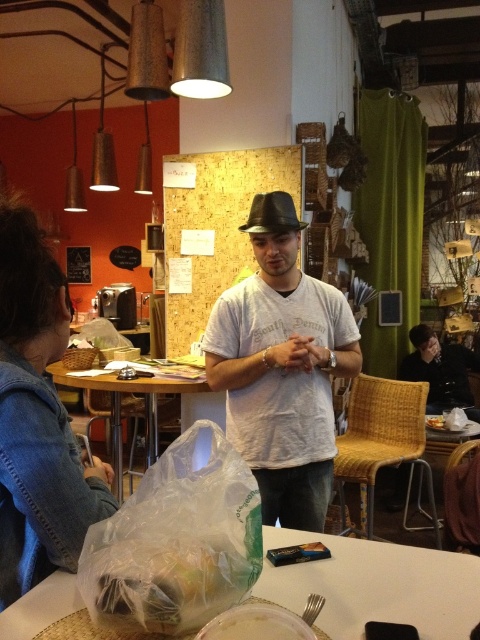
Question: Which point is farther to the camera?

Choices:
 (A) (16, 620)
 (B) (290, 422)
 (C) (256, 180)
 (D) (292, 632)

Answer: (C)

Question: Does corkboard at center have a larger size compared to white plastic container at lower center?

Choices:
 (A) yes
 (B) no

Answer: (A)

Question: Which object appears closest to the camera in this image?

Choices:
 (A) matte black fedora at center
 (B) denim jacket at lower left
 (C) white plastic container at lower center

Answer: (C)

Question: Can you confirm if white matte shirt at center is thinner than corkboard at center?

Choices:
 (A) yes
 (B) no

Answer: (A)

Question: Can you confirm if clear plastic bag at lower left is thinner than matte black fedora at center?

Choices:
 (A) yes
 (B) no

Answer: (B)

Question: Which of the following is the farthest from the observer?

Choices:
 (A) white matte shirt at center
 (B) matte black fedora at center
 (C) clear plastic bag at lower center

Answer: (B)